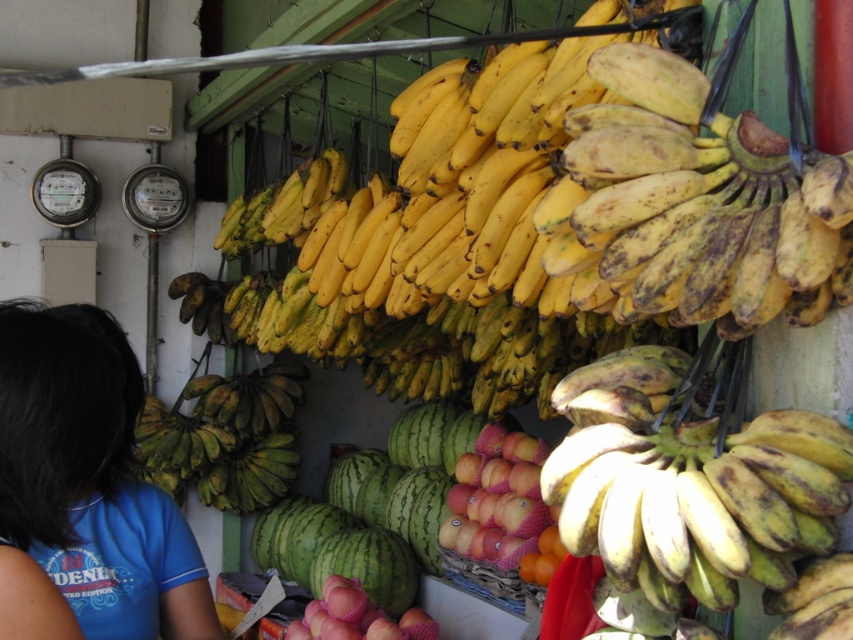
Can you confirm if ripe yellow bananas at center is positioned above blue fabric shirt at lower left?

Indeed, ripe yellow bananas at center is positioned over blue fabric shirt at lower left.

Does ripe yellow bananas at center appear on the left side of blue fabric shirt at lower left?

No, ripe yellow bananas at center is not to the left of blue fabric shirt at lower left.

This screenshot has height=640, width=853. Identify the location of ripe yellow bananas at center. (701, 196).

Which is behind, point (762, 164) or point (790, 508)?

The point (762, 164) is more distant.

Which is more to the left, ripe yellow bananas at center or yellow matte bananas at center?

Positioned to the left is ripe yellow bananas at center.

Is point (755, 248) positioned after point (767, 509)?

Yes, point (755, 248) is behind point (767, 509).

What are the coordinates of `ripe yellow bananas at center` in the screenshot? It's located at (701, 196).

Does blue fabric shirt at lower left appear over yellow matte bananas at center?

Actually, blue fabric shirt at lower left is below yellow matte bananas at center.

Can you confirm if blue fabric shirt at lower left is wider than yellow matte bananas at center?

Incorrect, blue fabric shirt at lower left's width does not surpass yellow matte bananas at center's.

Does point (112, 518) lie behind point (602, 481)?

That is True.

Identify the location of blue fabric shirt at lower left. Image resolution: width=853 pixels, height=640 pixels. (86, 486).